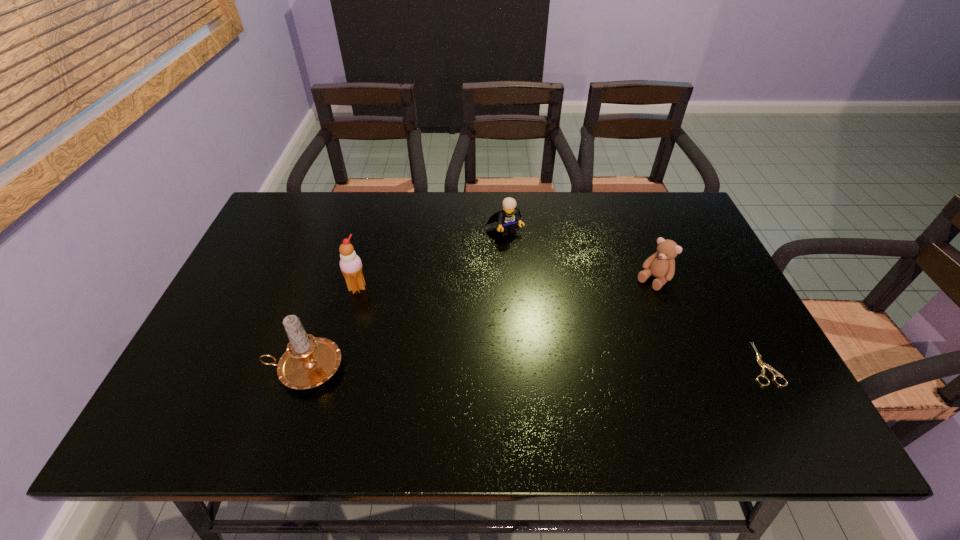
Identify the location of vacant point located between the icecream and the third object from left to right. This screenshot has width=960, height=540. (431, 259).

Identify the location of free point between the third object from right to left and the shortest object. This screenshot has height=540, width=960. (x=634, y=297).

Where is `empty location between the candle and the rightmost object`? This screenshot has height=540, width=960. empty location between the candle and the rightmost object is located at coordinates (534, 366).

Find the location of a particular element. free space between the icecream and the fourth object from left to right is located at coordinates (505, 284).

Where is `free spot between the fourth object from left to right and the third object from left to right`? free spot between the fourth object from left to right and the third object from left to right is located at coordinates (579, 255).

This screenshot has width=960, height=540. Identify the location of vacant point located between the fourth object from left to right and the third object from right to left. (579, 255).

Where is `free spot between the icecream and the second object from right to left`? free spot between the icecream and the second object from right to left is located at coordinates (505, 284).

Locate an element on the screen. This screenshot has height=540, width=960. vacant area between the Lego and the shortest object is located at coordinates (634, 297).

Where is `free space that is in between the icecream and the candle`? The width and height of the screenshot is (960, 540). free space that is in between the icecream and the candle is located at coordinates (331, 328).

Find the location of a particular element. The height and width of the screenshot is (540, 960). unoccupied area between the icecream and the third object from left to right is located at coordinates (431, 259).